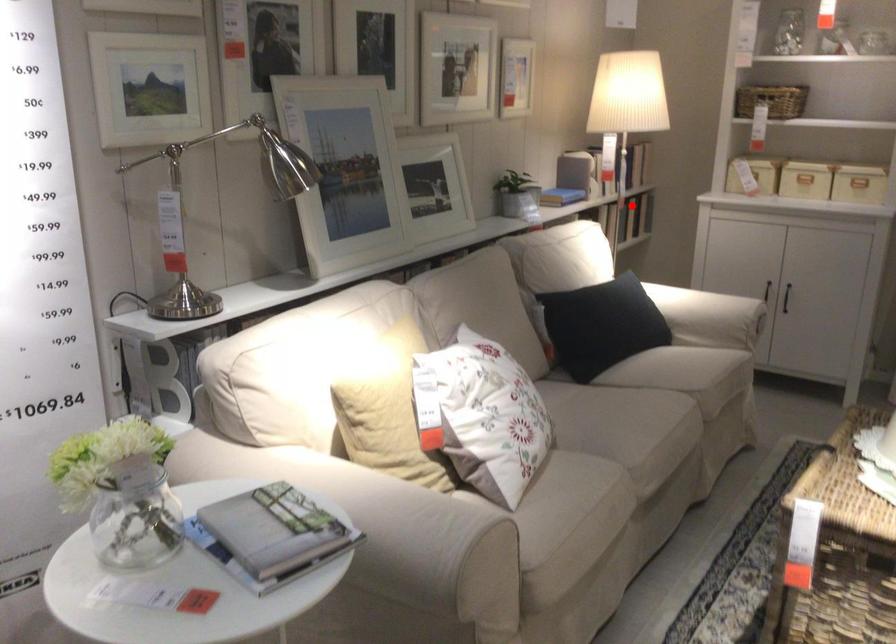
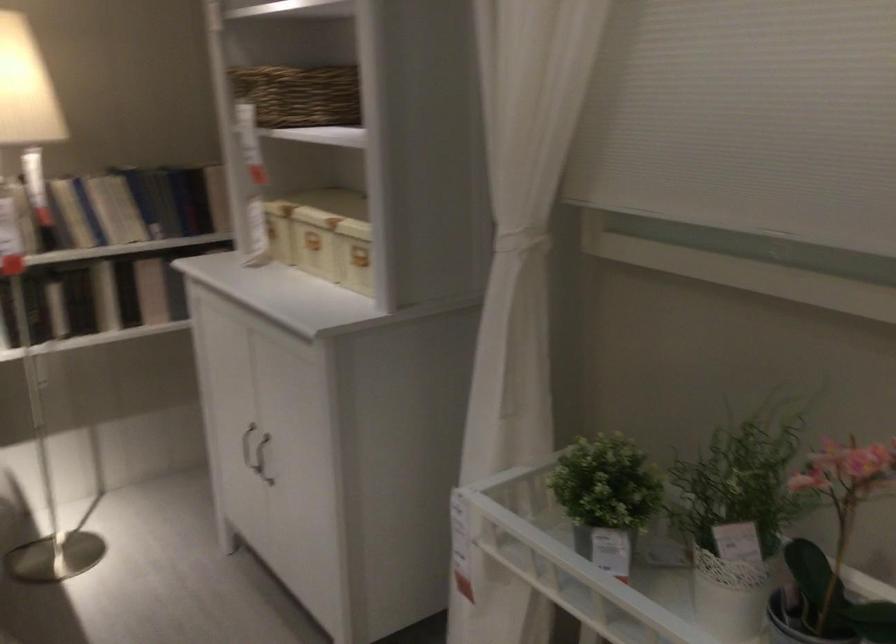
The point at the highlighted location is marked in the first image. Where is the corresponding point in the second image?

(151, 290)